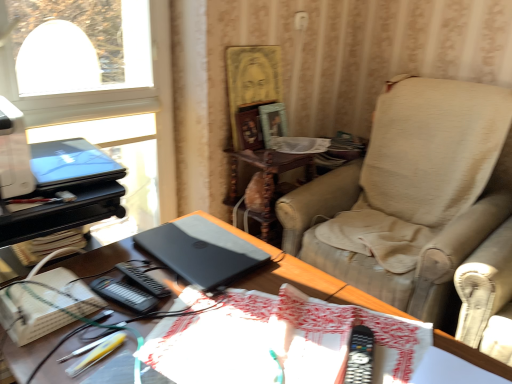
Describe the element at coordinates (249, 127) in the screenshot. The image size is (512, 384). I see `wooden picture frame at center, acting as the 2th picture frame starting from the right` at that location.

Identify the location of wooden side table at center. The width and height of the screenshot is (512, 384). (273, 177).

What do you see at coordinates (273, 177) in the screenshot? This screenshot has width=512, height=384. I see `wooden side table at center` at bounding box center [273, 177].

Where is `white cardboard book at lower left`? white cardboard book at lower left is located at coordinates (29, 316).

What do you see at coordinates (29, 316) in the screenshot? I see `white cardboard book at lower left` at bounding box center [29, 316].

From the picture: Measure the distance between matte wooden picture frame at upper center, which is the 2th picture frame in left-to-right order, and camera.

The distance of matte wooden picture frame at upper center, which is the 2th picture frame in left-to-right order, from camera is 2.00 meters.

Image resolution: width=512 pixels, height=384 pixels. Describe the element at coordinates (360, 356) in the screenshot. I see `black plastic remote control at lower right` at that location.

Measure the distance between beige fabric chair at right and camera.

beige fabric chair at right is 4.70 feet from camera.

Where is `satin black laptop at center`? satin black laptop at center is located at coordinates [x=301, y=276].

You are a GUI agent. You are given a task and a screenshot of the screen. Output one action in this format:
    pyautogui.click(x=<x>, y=<y>)
    Task: Click on the matte black laptop at center, marked as the second laptop in a left-to-right arrangement
    The image size is (512, 384).
    Given the screenshot: What is the action you would take?
    pyautogui.click(x=201, y=252)

From the image's perspective, relative to matte wooden picture frame at upper center, which ranks as the first picture frame in right-to-left order, is matte black laptop at upper left, marked as the second laptop in a right-to-left arrangement, above or below?

Based on their image positions, matte black laptop at upper left, marked as the second laptop in a right-to-left arrangement, is located beneath matte wooden picture frame at upper center, which ranks as the first picture frame in right-to-left order.

Who is taller, matte black laptop at upper left, the 2th laptop positioned from the bottom, or matte wooden picture frame at upper center, which ranks as the first picture frame in right-to-left order?

matte wooden picture frame at upper center, which ranks as the first picture frame in right-to-left order.

Is matte black laptop at upper left, the 2th laptop positioned from the bottom, wider than matte wooden picture frame at upper center, which is the 2th picture frame in left-to-right order?

Correct, the width of matte black laptop at upper left, the 2th laptop positioned from the bottom, exceeds that of matte wooden picture frame at upper center, which is the 2th picture frame in left-to-right order.

From the picture: From a real-world perspective, between matte black laptop at upper left, the 2th laptop positioned from the bottom, and matte wooden picture frame at upper center, which is the 2th picture frame in left-to-right order, who is vertically lower?

In real-world perspective, matte wooden picture frame at upper center, which is the 2th picture frame in left-to-right order, is lower.

Considering the positions of point (42, 312) and point (198, 252), is point (42, 312) closer or farther from the camera than point (198, 252)?

Point (42, 312).

Is white cardboard book at lower left directly adjacent to matte black laptop at center, which is counted as the first laptop, starting from the right?

No, white cardboard book at lower left is not making contact with matte black laptop at center, which is counted as the first laptop, starting from the right.

Is white cardboard book at lower left situated inside matte black laptop at center, marked as the second laptop in a left-to-right arrangement, or outside?

white cardboard book at lower left cannot be found inside matte black laptop at center, marked as the second laptop in a left-to-right arrangement.

Does point (57, 160) lie in front of point (249, 133)?

Yes, it is in front of point (249, 133).

Can you tell me how much matte black laptop at upper left, the 2th laptop positioned from the bottom, and wooden picture frame at center, acting as the 2th picture frame starting from the right, differ in facing direction?

The angle between the facing direction of matte black laptop at upper left, the 2th laptop positioned from the bottom, and the facing direction of wooden picture frame at center, acting as the 2th picture frame starting from the right, is 9.48 degrees.

Is the depth of matte black laptop at upper left, the 2th laptop positioned from the bottom, less than that of wooden picture frame at center, acting as the 2th picture frame starting from the right?

Yes, matte black laptop at upper left, the 2th laptop positioned from the bottom, is closer to the camera.

Is matte black laptop at upper left, which is counted as the 1th laptop, starting from the top, outside of wooden picture frame at center, acting as the first picture frame starting from the left?

Absolutely, matte black laptop at upper left, which is counted as the 1th laptop, starting from the top, is external to wooden picture frame at center, acting as the first picture frame starting from the left.

Where is `chair located on the right of satin black laptop at center`? The height and width of the screenshot is (384, 512). chair located on the right of satin black laptop at center is located at coordinates (410, 195).

Is satin black laptop at center with beige fabric chair at right?

No, satin black laptop at center is not beside beige fabric chair at right.

From a real-world perspective, relative to beige fabric chair at right, is satin black laptop at center vertically above or below?

satin black laptop at center is situated lower than beige fabric chair at right in the real world.

Which of these two, satin black laptop at center or beige fabric chair at right, is thinner?

Thinner between the two is satin black laptop at center.

The height and width of the screenshot is (384, 512). In order to click on the 2nd picture frame counting from the right of the matte black laptop at upper left, marked as the second laptop in a right-to-left arrangement in this screenshot , I will do `click(272, 121)`.

Is matte wooden picture frame at upper center, which ranks as the first picture frame in right-to-left order, next to matte black laptop at upper left, which is counted as the 1th laptop, starting from the top?

No, matte wooden picture frame at upper center, which ranks as the first picture frame in right-to-left order, is not with matte black laptop at upper left, which is counted as the 1th laptop, starting from the top.

Looking at this image, could you tell me if matte wooden picture frame at upper center, which is the 2th picture frame in left-to-right order, is facing matte black laptop at upper left, the first laptop when ordered from left to right?

No, matte wooden picture frame at upper center, which is the 2th picture frame in left-to-right order, is not facing towards matte black laptop at upper left, the first laptop when ordered from left to right.

Who is smaller, matte wooden picture frame at upper center, which ranks as the first picture frame in right-to-left order, or matte black laptop at upper left, the 2th laptop positioned from the bottom?

matte wooden picture frame at upper center, which ranks as the first picture frame in right-to-left order, is smaller.

Is point (421, 114) closer to viewer compared to point (80, 276)?

No, (421, 114) is behind (80, 276).

Is beige fabric chair at right next to satin black laptop at center and touching it?

beige fabric chair at right and satin black laptop at center are clearly separated.

Looking at their sizes, would you say beige fabric chair at right is wider or thinner than satin black laptop at center?

beige fabric chair at right is wider than satin black laptop at center.

From a real-world perspective, does beige fabric chair at right sit lower than satin black laptop at center?

No.

How much distance is there between matte wooden picture frame at upper center, which ranks as the first picture frame in right-to-left order, and beige fabric chair at right?

matte wooden picture frame at upper center, which ranks as the first picture frame in right-to-left order, and beige fabric chair at right are 25.89 inches apart.

Is matte wooden picture frame at upper center, which is the 2th picture frame in left-to-right order, positioned with its back to beige fabric chair at right?

No, matte wooden picture frame at upper center, which is the 2th picture frame in left-to-right order, is not facing the opposite direction of beige fabric chair at right.

Considering the relative positions of matte wooden picture frame at upper center, which is the 2th picture frame in left-to-right order, and beige fabric chair at right in the image provided, is matte wooden picture frame at upper center, which is the 2th picture frame in left-to-right order, to the right of beige fabric chair at right from the viewer's perspective?

Incorrect, matte wooden picture frame at upper center, which is the 2th picture frame in left-to-right order, is not on the right side of beige fabric chair at right.

Locate an element on the screen. The image size is (512, 384). the 2nd picture frame above the matte black laptop at upper left, marked as the second laptop in a right-to-left arrangement (from the image's perspective) is located at coordinates (272, 121).

Find the location of a particular element. The width and height of the screenshot is (512, 384). paperback book below the matte black laptop at center, marked as the second laptop in a top-to-bottom arrangement (from the image's perspective) is located at coordinates (29, 316).

Considering their positions, is beige fabric chair at right positioned further to matte black laptop at center, which is counted as the first laptop, starting from the bottom, than black plastic remote control at lower right?

Among the two, beige fabric chair at right is located further to matte black laptop at center, which is counted as the first laptop, starting from the bottom.

When comparing their distances from matte black laptop at center, marked as the second laptop in a top-to-bottom arrangement, does beige fabric chair at right or matte black laptop at upper left, the 2th laptop positioned from the bottom, seem closer?

matte black laptop at upper left, the 2th laptop positioned from the bottom, lies closer to matte black laptop at center, marked as the second laptop in a top-to-bottom arrangement, than the other object.

Which object lies nearer to the anchor point wooden picture frame at center, acting as the 2th picture frame starting from the right, matte black laptop at upper left, which is counted as the 1th laptop, starting from the top, or white cardboard book at lower left?

matte black laptop at upper left, which is counted as the 1th laptop, starting from the top, is closer to wooden picture frame at center, acting as the 2th picture frame starting from the right.

Estimate the real-world distances between objects in this image. Which object is further from satin black laptop at center, matte wooden picture frame at upper center, which ranks as the first picture frame in right-to-left order, or beige fabric chair at right?

matte wooden picture frame at upper center, which ranks as the first picture frame in right-to-left order, lies further to satin black laptop at center than the other object.

Which object lies further to the anchor point satin black laptop at center, wooden side table at center or matte wooden picture frame at upper center, which is the 2th picture frame in left-to-right order?

Among the two, matte wooden picture frame at upper center, which is the 2th picture frame in left-to-right order, is located further to satin black laptop at center.

From the image, which object appears to be nearer to matte black laptop at center, marked as the second laptop in a left-to-right arrangement, matte wooden picture frame at upper center, which ranks as the first picture frame in right-to-left order, or satin black laptop at center?

The object closer to matte black laptop at center, marked as the second laptop in a left-to-right arrangement, is satin black laptop at center.

Which object lies further to the anchor point white cardboard book at lower left, black plastic remote control at lower right or beige fabric chair at right?

The object further to white cardboard book at lower left is beige fabric chair at right.

When comparing their distances from matte black laptop at upper left, which is counted as the 1th laptop, starting from the top, does white cardboard book at lower left or satin black laptop at center seem closer?

Based on the image, satin black laptop at center appears to be nearer to matte black laptop at upper left, which is counted as the 1th laptop, starting from the top.

Image resolution: width=512 pixels, height=384 pixels. What are the coordinates of `equipment between satin black laptop at center and wooden side table at center in the front-back direction` in the screenshot? It's located at (360, 356).

This screenshot has width=512, height=384. In order to click on chair between matte black laptop at center, which is counted as the first laptop, starting from the right, and wooden picture frame at center, acting as the 2th picture frame starting from the right, from front to back in this screenshot , I will do `click(410, 195)`.

At what (x,y) coordinates should I click in order to perform the action: click on laptop between white cardboard book at lower left and beige fabric chair at right in the horizontal direction. Please return your answer as a coordinate pair (x, y). Image resolution: width=512 pixels, height=384 pixels. Looking at the image, I should click on (201, 252).

This screenshot has height=384, width=512. Identify the location of equipment between satin black laptop at center and beige fabric chair at right in the front-back direction. 360,356.